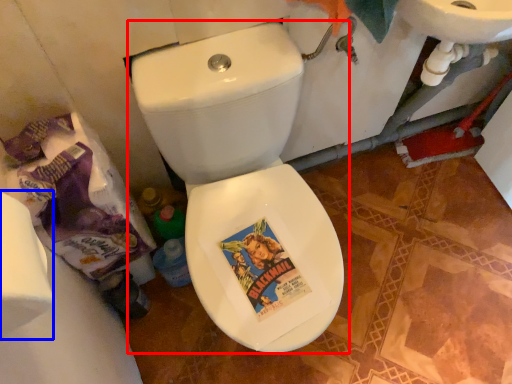
Question: Which point is further to the camera, toilet (highlighted by a red box) or toilet paper (highlighted by a blue box)?

Choices:
 (A) toilet
 (B) toilet paper

Answer: (A)